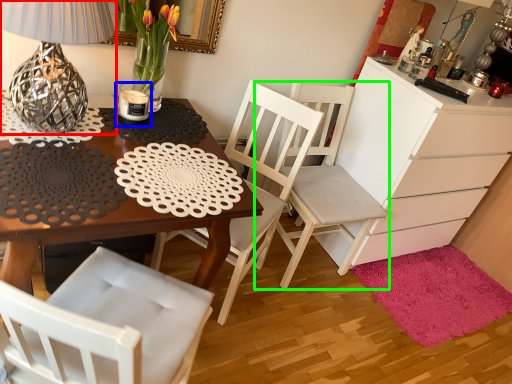
Question: Which is nearer to the table lamp (highlighted by a red box)? candle holder (highlighted by a blue box) or chair (highlighted by a green box).

Choices:
 (A) candle holder
 (B) chair

Answer: (A)